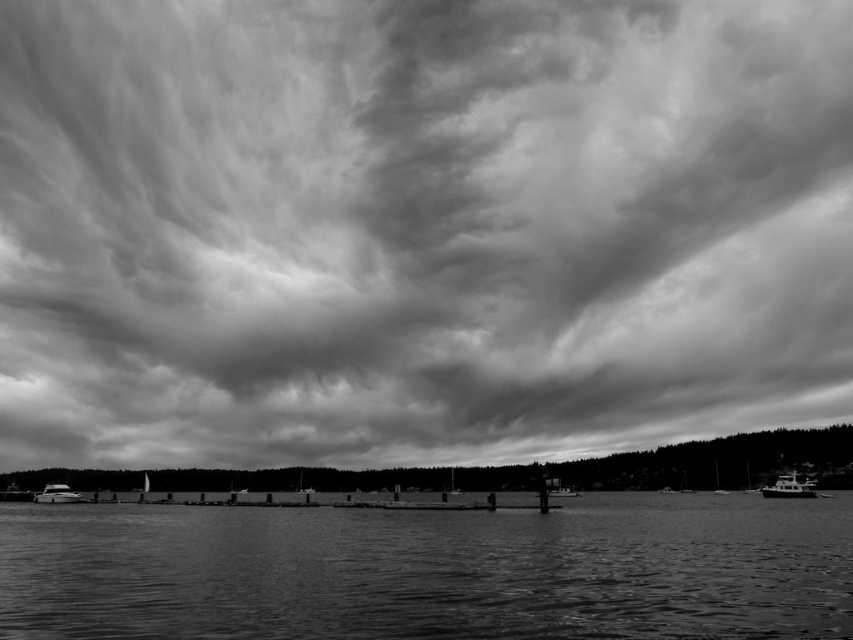
Question: Which of these objects is positioned closest to the metallic silver boat at lower right?

Choices:
 (A) cloudy sky at upper center
 (B) metallic silver boat at lower left

Answer: (B)

Question: Does cloudy sky at upper center lie in front of smooth water at center?

Choices:
 (A) yes
 (B) no

Answer: (B)

Question: Estimate the real-world distances between objects in this image. Which object is farther from the metallic silver boat at lower right?

Choices:
 (A) metallic silver boat at lower left
 (B) smooth water at center

Answer: (A)

Question: Can you confirm if metallic silver boat at lower right is bigger than metallic silver boat at lower left?

Choices:
 (A) yes
 (B) no

Answer: (A)

Question: Which point appears farthest from the camera in this image?

Choices:
 (A) (761, 512)
 (B) (399, 60)
 (C) (68, 490)

Answer: (B)

Question: Does smooth water at center lie in front of metallic silver boat at lower right?

Choices:
 (A) no
 (B) yes

Answer: (B)